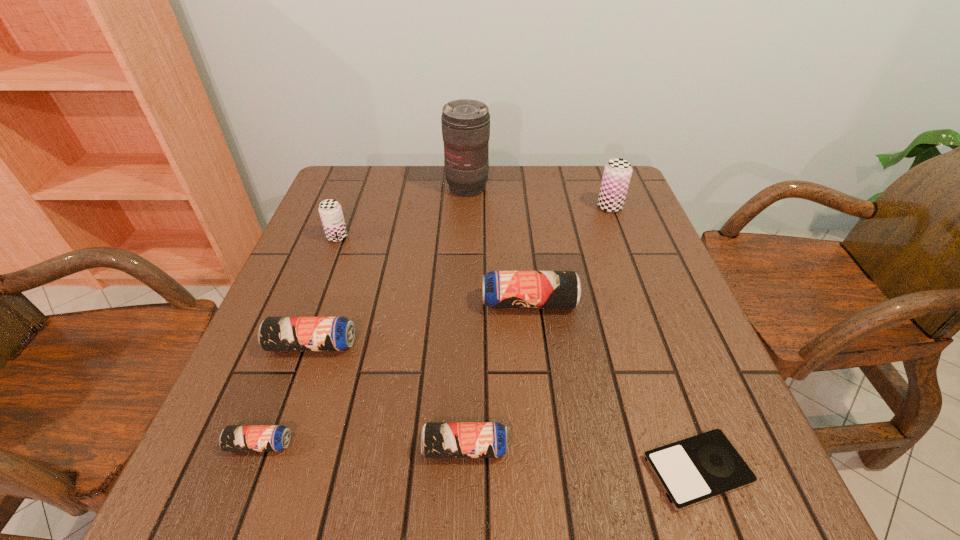
At what (x,y) coordinates should I click in order to perform the action: click on the third shortest object. Please return your answer as a coordinate pair (x, y). Looking at the image, I should click on (438, 439).

The width and height of the screenshot is (960, 540). I want to click on the seventh tallest object, so click(x=233, y=437).

In order to click on the shortest beer can in this screenshot , I will do `click(233, 437)`.

Locate an element on the screen. The height and width of the screenshot is (540, 960). the shortest object is located at coordinates (699, 468).

The height and width of the screenshot is (540, 960). I want to click on gray iPod, so click(699, 468).

The width and height of the screenshot is (960, 540). In order to click on free point located on the side of the telephoto lens where the control switches are located in this screenshot , I will do `click(464, 269)`.

Find the location of a particular element. The height and width of the screenshot is (540, 960). vacant space located 0.220m on the front of the seventh shortest object is located at coordinates (634, 269).

At what (x,y) coordinates should I click in order to perform the action: click on free point located 0.220m on the back of the left purple beer can. Please return your answer as a coordinate pair (x, y). The width and height of the screenshot is (960, 540). Looking at the image, I should click on (357, 185).

The image size is (960, 540). In order to click on free space located on the front of the farthest blue beer can in this screenshot , I will do `click(536, 360)`.

Locate an element on the screen. This screenshot has width=960, height=540. blank space located on the right of the fifth farthest object is located at coordinates (446, 345).